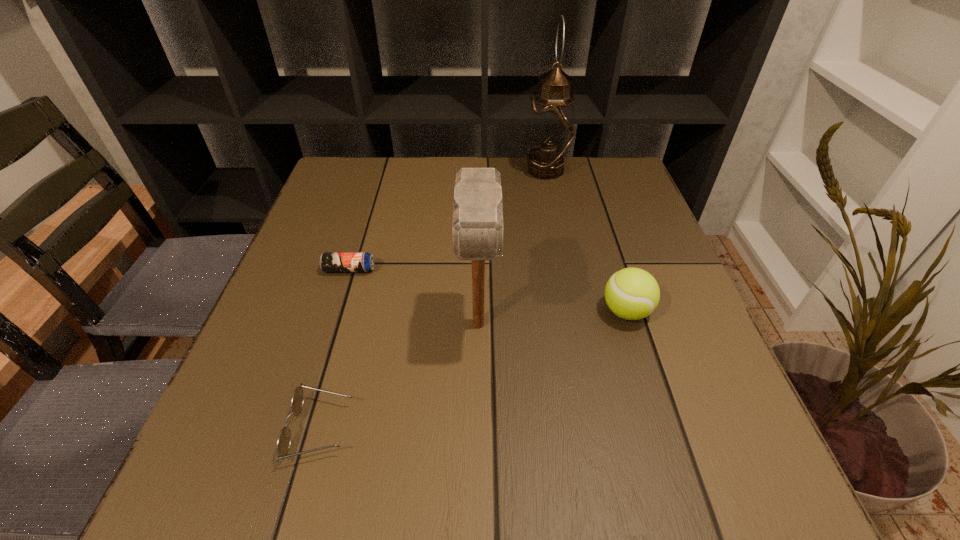
You are a GUI agent. You are given a task and a screenshot of the screen. Output one action in this format:
    pyautogui.click(x=<x>, y=<y>)
    Task: Click on the vacant area that lies between the fourth nearest object and the mallet
    This screenshot has height=540, width=960.
    Given the screenshot: What is the action you would take?
    pyautogui.click(x=414, y=296)

You are a GUI agent. You are given a task and a screenshot of the screen. Output one action in this format:
    pyautogui.click(x=<x>, y=<y>)
    Task: Click on the free space between the beer can and the spectacles
    
    Given the screenshot: What is the action you would take?
    [x=335, y=349]

Identify the location of free area in between the third tallest object and the nearest object. (473, 370).

The width and height of the screenshot is (960, 540). Find the location of `free space between the nearest object and the tennis ball`. free space between the nearest object and the tennis ball is located at coordinates (473, 370).

Where is `vacant area that lies between the nearest object and the beer can`? vacant area that lies between the nearest object and the beer can is located at coordinates [335, 349].

The width and height of the screenshot is (960, 540). In order to click on object that is the second closest to the nearest object in this screenshot , I will do `click(329, 261)`.

Locate which object is the third closest to the fourth nearest object. Please provide its 2D coordinates. Your answer should be formatted as a tuple, i.e. [(x, y)], where the tuple contains the x and y coordinates of a point satisfying the conditions above.

[(632, 293)]